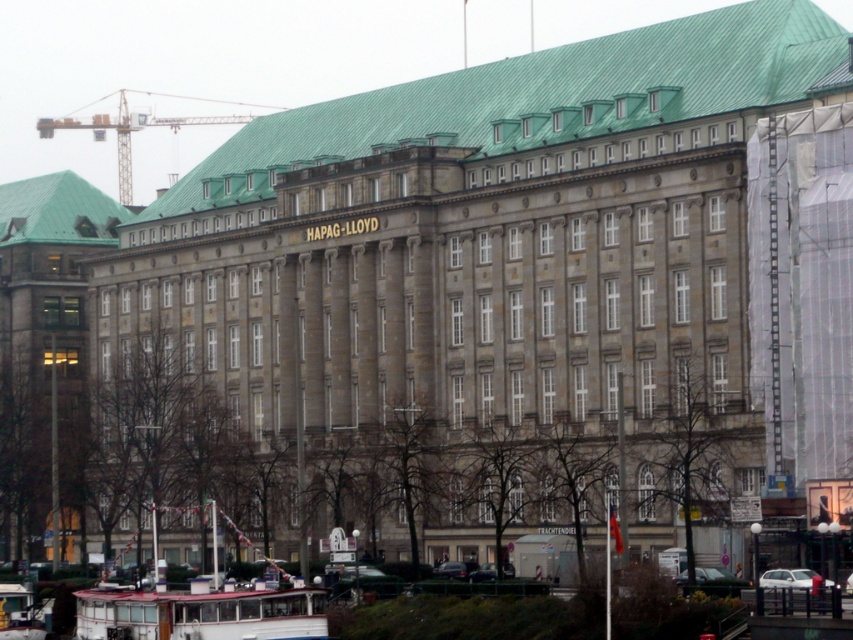
Question: Is the position of white plastic boat at lower left more distant than that of metallic yellow crane at upper left?

Choices:
 (A) yes
 (B) no

Answer: (B)

Question: Which of the following is the farthest from the observer?

Choices:
 (A) (131, 168)
 (B) (260, 600)

Answer: (A)

Question: Which point appears closest to the camera in this image?

Choices:
 (A) (315, 609)
 (B) (125, 134)

Answer: (A)

Question: Is the position of white plastic boat at lower left less distant than that of metallic yellow crane at upper left?

Choices:
 (A) no
 (B) yes

Answer: (B)

Question: Does white plastic boat at lower left have a smaller size compared to metallic yellow crane at upper left?

Choices:
 (A) no
 (B) yes

Answer: (B)